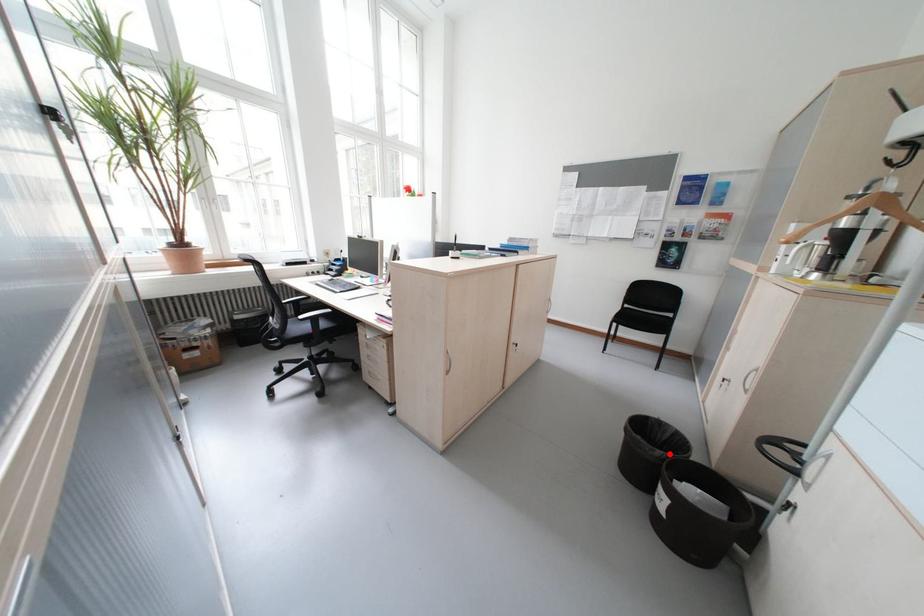
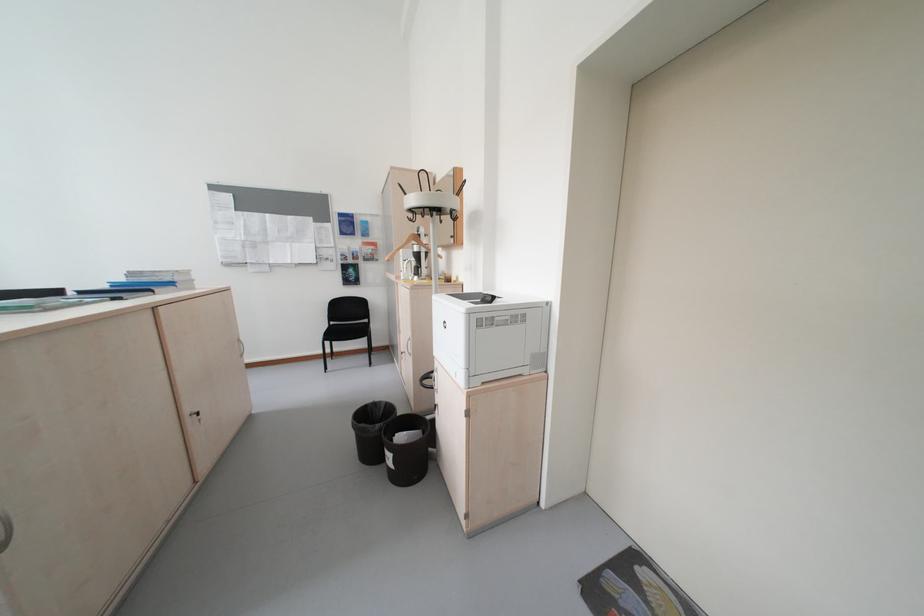
The point at the highlighted location is marked in the first image. Where is the corresponding point in the second image?

(388, 427)